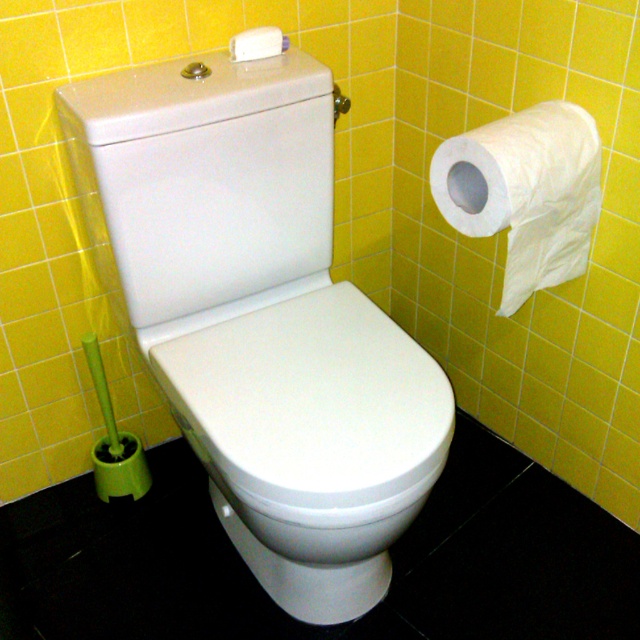
Does point (525, 188) come in front of point (264, 35)?

Yes, point (525, 188) is in front of point (264, 35).

Can you confirm if white paper at upper right is positioned above white matte tissue at upper center?

No.

I want to click on white paper at upper right, so click(x=525, y=193).

In order to click on white paper at upper right in this screenshot , I will do `click(525, 193)`.